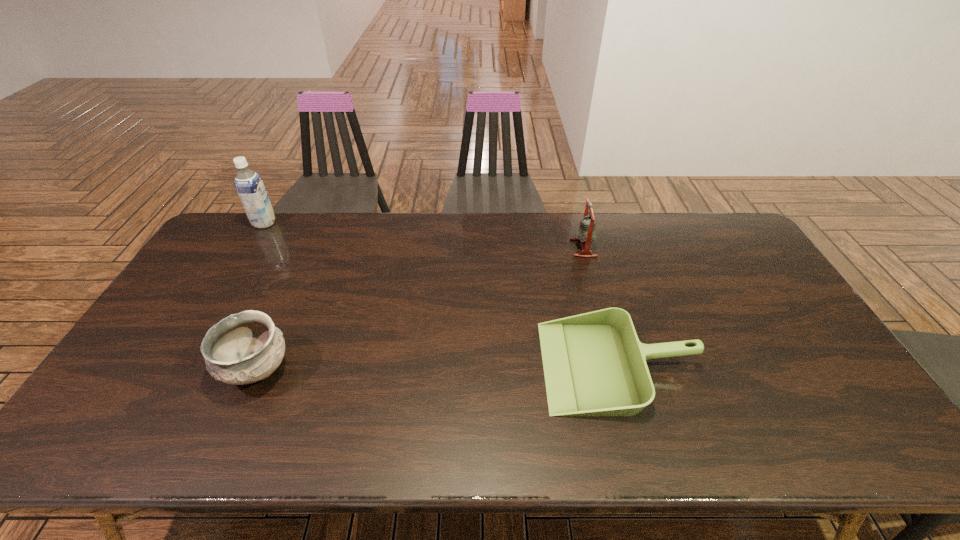
The width and height of the screenshot is (960, 540). I want to click on the leftmost object, so click(x=249, y=185).

Image resolution: width=960 pixels, height=540 pixels. What are the coordinates of `the farthest object` in the screenshot? It's located at (249, 185).

At what (x,y) coordinates should I click in order to perform the action: click on the second farthest object. Please return your answer as a coordinate pair (x, y). The width and height of the screenshot is (960, 540). Looking at the image, I should click on (586, 233).

Identify the location of bell. (586, 233).

I want to click on the third object from right to left, so click(246, 347).

The height and width of the screenshot is (540, 960). I want to click on the third tallest object, so click(246, 347).

You are a GUI agent. You are given a task and a screenshot of the screen. Output one action in this format:
    pyautogui.click(x=<x>, y=<y>)
    Task: Click on the dustpan
    The width and height of the screenshot is (960, 540).
    Given the screenshot: What is the action you would take?
    pyautogui.click(x=594, y=364)

This screenshot has width=960, height=540. I want to click on vacant area situated 0.300m on the label of the farthest object, so click(357, 223).

I want to click on free space located 0.240m on the left of the third nearest object, so click(501, 248).

I want to click on free region located on the back of the pottery, so click(x=304, y=264).